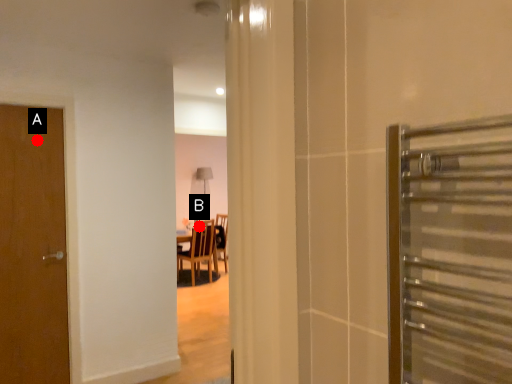
Question: Two points are circled on the image, labeled by A and B beside each circle. Which point is closer to the camera?

Choices:
 (A) A is closer
 (B) B is closer

Answer: (A)